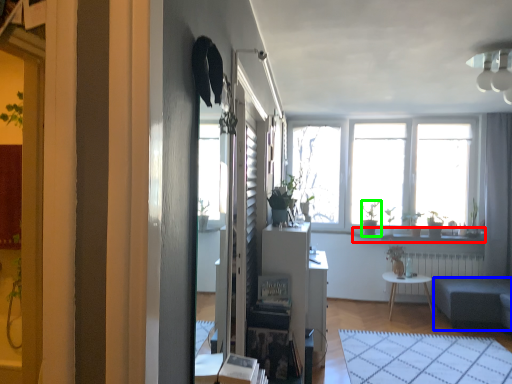
Question: Based on their relative distances, which object is farther from window sill (highlighted by a red box)? Choose from studio couch (highlighted by a blue box) and houseplant (highlighted by a green box).

Choices:
 (A) studio couch
 (B) houseplant

Answer: (A)